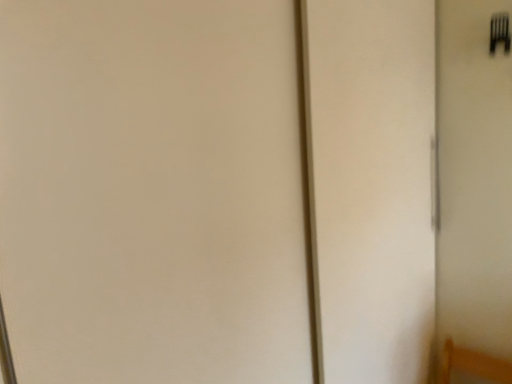
The width and height of the screenshot is (512, 384). Describe the element at coordinates (499, 32) in the screenshot. I see `black plastic fork at upper right` at that location.

Identify the location of black plastic fork at upper right. This screenshot has height=384, width=512. (499, 32).

This screenshot has height=384, width=512. I want to click on black plastic fork at upper right, so click(499, 32).